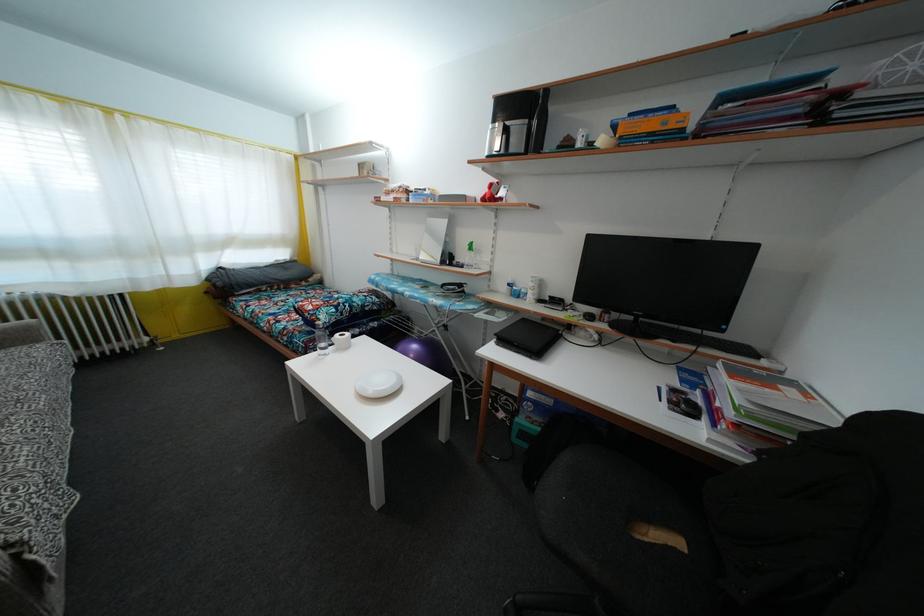
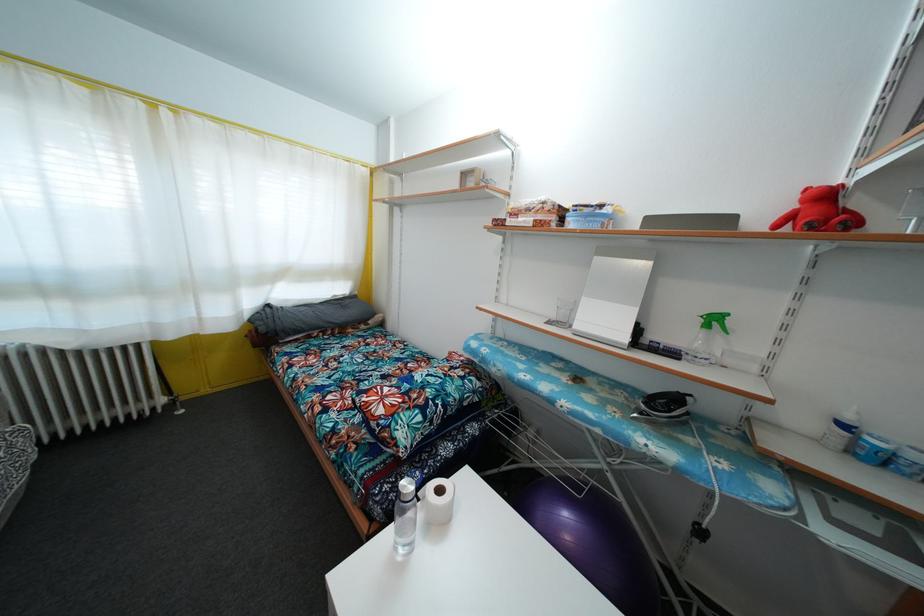
Find the pixel in the second image that matches point (429, 197) in the first image.

(605, 213)